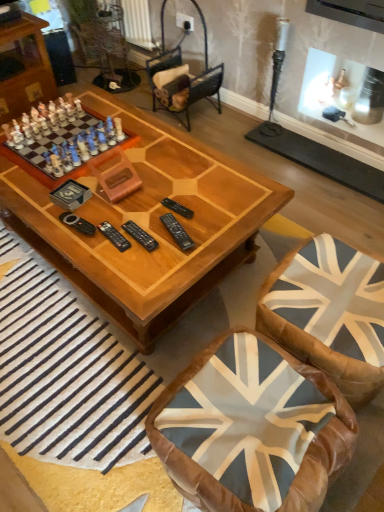
Image resolution: width=384 pixels, height=512 pixels. What are the coordinates of `free space that is to the left of black plastic remote at center` in the screenshot? It's located at (94, 237).